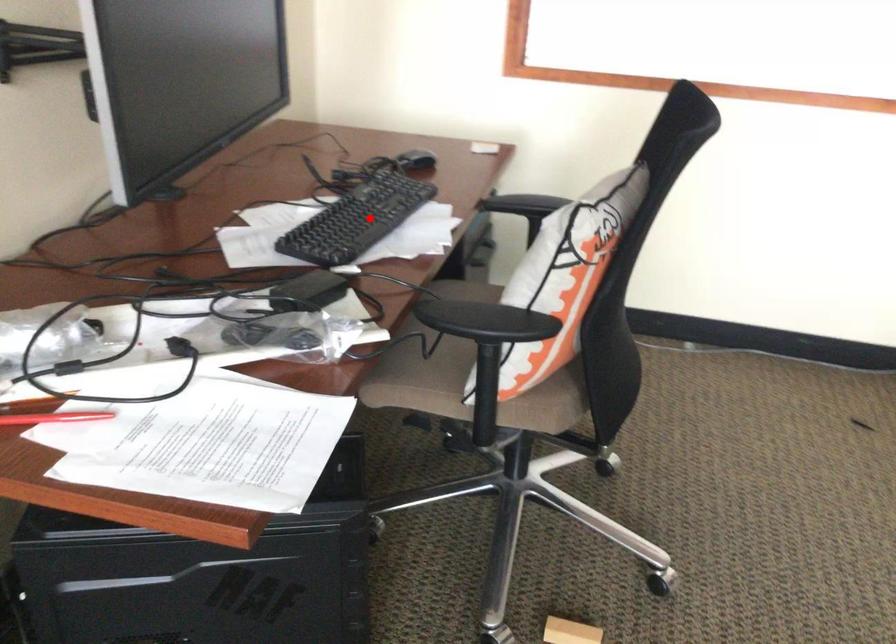
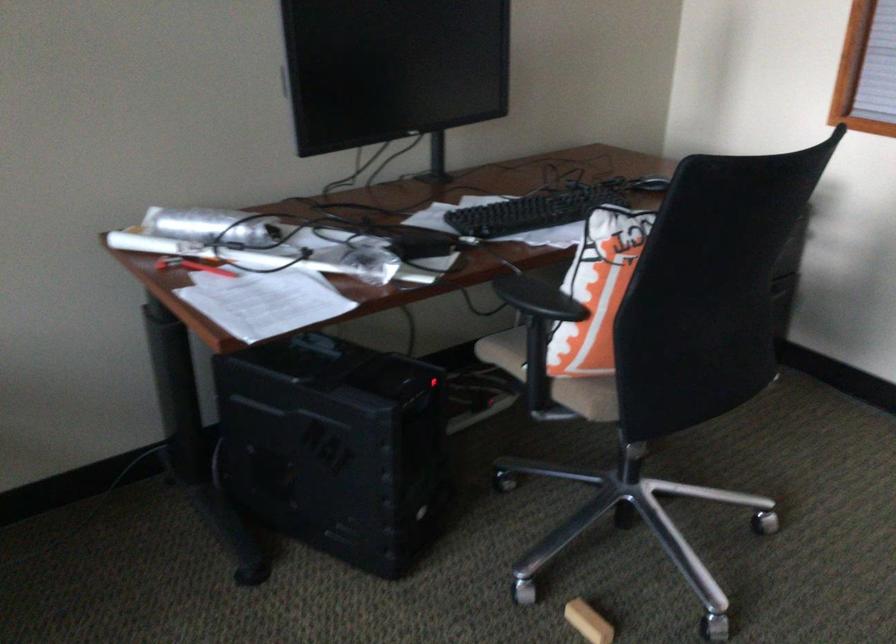
In the second image, find the point that corresponds to the highlighted location in the first image.

(532, 211)